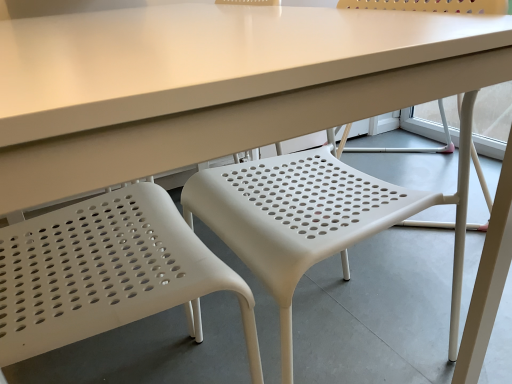
Question: Is white plastic chair at left, which is the 1th chair from left to right, situated inside white plastic chair at center, which appears as the second chair when viewed from the left, or outside?

Choices:
 (A) outside
 (B) inside

Answer: (A)

Question: Looking at the image, does white plastic chair at left, which is the 2th chair in right-to-left order, seem bigger or smaller compared to white plastic chair at center, which is the first chair in right-to-left order?

Choices:
 (A) small
 (B) big

Answer: (A)

Question: In the image, is white plastic chair at left, which is the 1th chair from left to right, on the left side or the right side of white plastic chair at center, which is the first chair in right-to-left order?

Choices:
 (A) left
 (B) right

Answer: (A)

Question: Considering the positions of white plastic chair at center, which appears as the second chair when viewed from the left, and white plastic chair at left, which is the 1th chair from left to right, in the image, is white plastic chair at center, which appears as the second chair when viewed from the left, bigger or smaller than white plastic chair at left, which is the 1th chair from left to right,?

Choices:
 (A) small
 (B) big

Answer: (B)

Question: Is white plastic chair at center, which appears as the second chair when viewed from the left, taller or shorter than white plastic chair at left, which is the 1th chair from left to right?

Choices:
 (A) tall
 (B) short

Answer: (B)

Question: From the image's perspective, is white plastic chair at center, which appears as the second chair when viewed from the left, located above or below white plastic chair at left, which is the 2th chair in right-to-left order?

Choices:
 (A) below
 (B) above

Answer: (B)

Question: Considering the positions of white plastic chair at center, which appears as the second chair when viewed from the left, and white plastic chair at left, which is the 2th chair in right-to-left order, in the image, is white plastic chair at center, which appears as the second chair when viewed from the left, wider or thinner than white plastic chair at left, which is the 2th chair in right-to-left order,?

Choices:
 (A) thin
 (B) wide

Answer: (B)